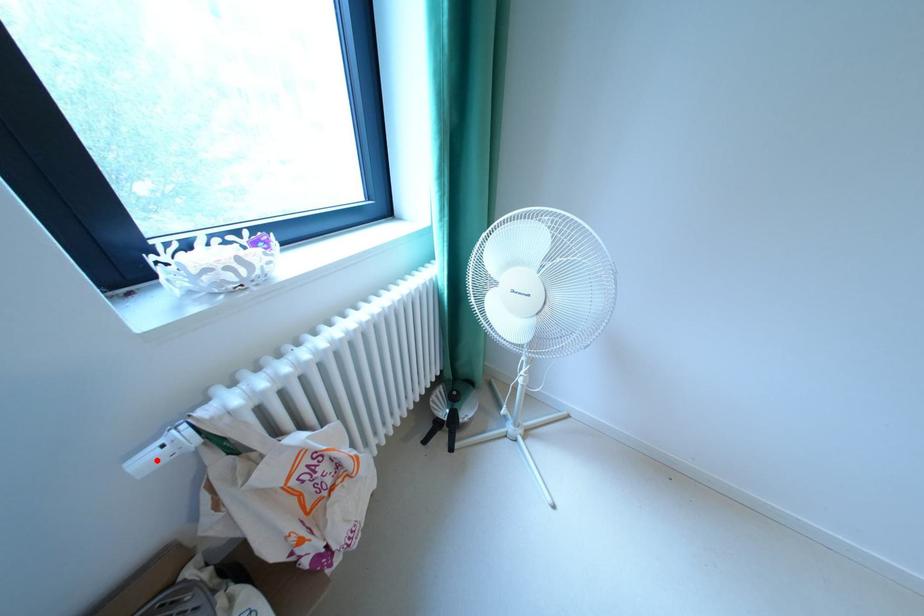
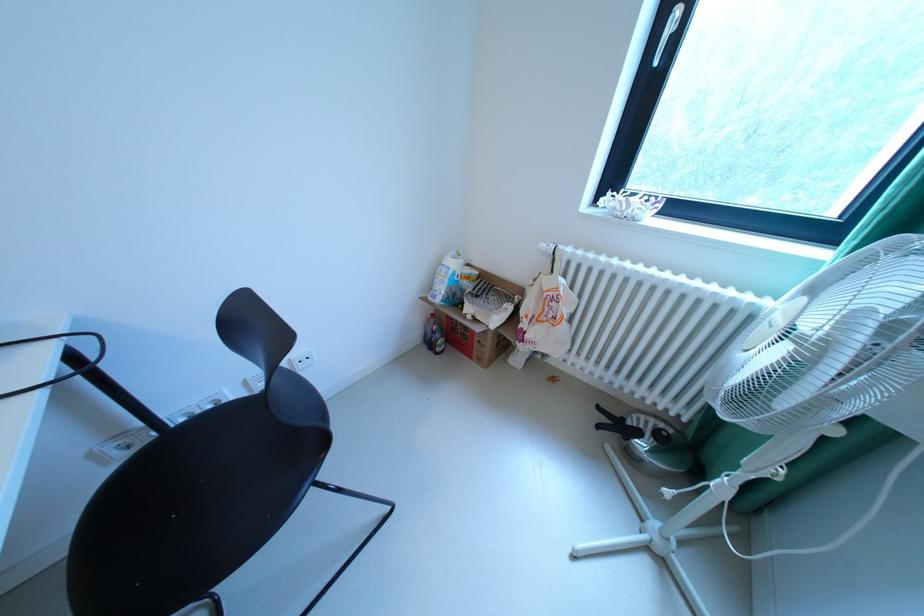
Where in the second image is the point corresponding to the highlighted location from the first image?

(553, 246)